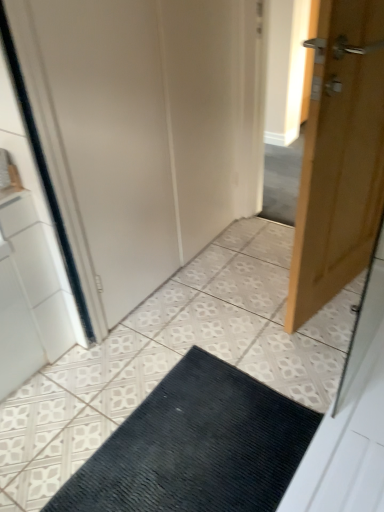
Question: Considering the relative sizes of white matte door at center and black textured mat at center in the image provided, is white matte door at center wider than black textured mat at center?

Choices:
 (A) yes
 (B) no

Answer: (A)

Question: From a real-world perspective, is white matte door at center on black textured mat at center?

Choices:
 (A) yes
 (B) no

Answer: (A)

Question: Considering the relative sizes of white matte door at center and black textured mat at center in the image provided, is white matte door at center thinner than black textured mat at center?

Choices:
 (A) yes
 (B) no

Answer: (B)

Question: Can you confirm if white matte door at center is taller than black textured mat at center?

Choices:
 (A) no
 (B) yes

Answer: (B)

Question: From the image's perspective, is white matte door at center below black textured mat at center?

Choices:
 (A) yes
 (B) no

Answer: (B)

Question: Visually, is white matte door at center positioned to the left or to the right of light brown wooden door at right?

Choices:
 (A) left
 (B) right

Answer: (A)

Question: Is white matte door at center bigger or smaller than light brown wooden door at right?

Choices:
 (A) big
 (B) small

Answer: (A)

Question: From the image's perspective, is white matte door at center above or below light brown wooden door at right?

Choices:
 (A) above
 (B) below

Answer: (A)

Question: Considering the positions of white matte door at center and light brown wooden door at right in the image, is white matte door at center wider or thinner than light brown wooden door at right?

Choices:
 (A) thin
 (B) wide

Answer: (B)

Question: Is black textured mat at center in front of or behind light brown wooden door at right in the image?

Choices:
 (A) behind
 (B) front

Answer: (B)

Question: From a real-world perspective, relative to light brown wooden door at right, is black textured mat at center vertically above or below?

Choices:
 (A) above
 (B) below

Answer: (B)

Question: Is point (205, 508) closer or farther from the camera than point (367, 118)?

Choices:
 (A) farther
 (B) closer

Answer: (B)

Question: From the image's perspective, is black textured mat at center positioned above or below light brown wooden door at right?

Choices:
 (A) below
 (B) above

Answer: (A)

Question: From their relative heights in the image, would you say black textured mat at center is taller or shorter than white matte door at center?

Choices:
 (A) tall
 (B) short

Answer: (B)

Question: In the image, is black textured mat at center positioned in front of or behind white matte door at center?

Choices:
 (A) behind
 (B) front

Answer: (B)